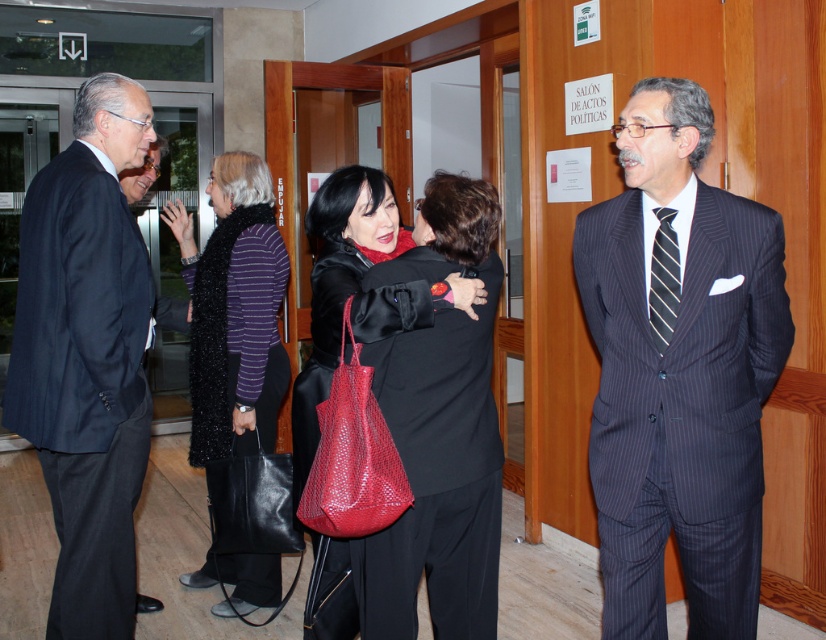
Is dark pinstripe suit at right below striped wool sweater at center?

Yes.

This screenshot has height=640, width=826. I want to click on dark pinstripe suit at right, so click(679, 374).

Is point (336, 241) more distant than point (654, 250)?

Yes, it is.

Measure the distance between point [331,177] and camera.

A distance of 2.29 meters exists between point [331,177] and camera.

Which is behind, point (333, 339) or point (653, 257)?

Positioned behind is point (333, 339).

Identify the location of matte black coat at center. The image size is (826, 640). (340, 273).

Is striped wool sweater at center smaller than matte black coat at center?

No, striped wool sweater at center is not smaller than matte black coat at center.

Can you confirm if striped wool sweater at center is positioned to the right of matte black coat at center?

In fact, striped wool sweater at center is to the left of matte black coat at center.

Locate an element on the screen. striped wool sweater at center is located at coordinates (235, 310).

The width and height of the screenshot is (826, 640). In order to click on striped wool sweater at center in this screenshot , I will do `click(235, 310)`.